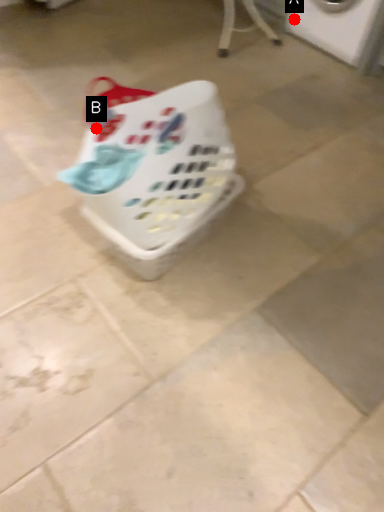
Question: Two points are circled on the image, labeled by A and B beside each circle. Which point appears closest to the camera in this image?

Choices:
 (A) A is closer
 (B) B is closer

Answer: (B)